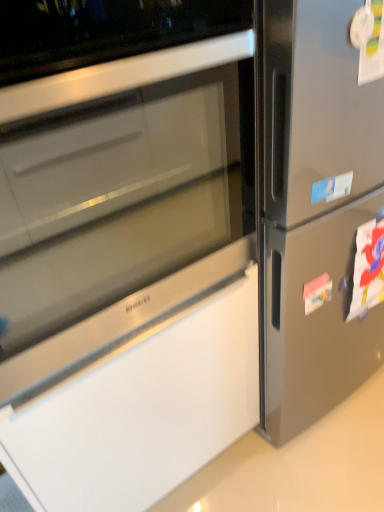
Question: From the image's perspective, is pink matte paper at right, positioned as the first sticker in bottom-to-top order, located above or below blue paper sticker at upper right, positioned as the 2th sticker in bottom-to-top order?

Choices:
 (A) below
 (B) above

Answer: (A)

Question: Does point (324, 288) appear closer or farther from the camera than point (345, 178)?

Choices:
 (A) closer
 (B) farther

Answer: (B)

Question: Considering the positions of pink matte paper at right, positioned as the first sticker in bottom-to-top order, and blue paper sticker at upper right, positioned as the 2th sticker in bottom-to-top order, in the image, is pink matte paper at right, positioned as the first sticker in bottom-to-top order, taller or shorter than blue paper sticker at upper right, positioned as the 2th sticker in bottom-to-top order,?

Choices:
 (A) short
 (B) tall

Answer: (B)

Question: From a real-world perspective, is blue paper sticker at upper right, which appears as the first sticker when viewed from the top, physically located above or below pink matte paper at right, positioned as the second sticker in top-to-bottom order?

Choices:
 (A) above
 (B) below

Answer: (A)

Question: Is blue paper sticker at upper right, which is the 1th sticker from front to back, inside or outside of pink matte paper at right, positioned as the second sticker in top-to-bottom order?

Choices:
 (A) inside
 (B) outside

Answer: (B)

Question: In terms of height, does blue paper sticker at upper right, the 2th sticker viewed from the back, look taller or shorter compared to pink matte paper at right, positioned as the first sticker in bottom-to-top order?

Choices:
 (A) short
 (B) tall

Answer: (A)

Question: Relative to pink matte paper at right, positioned as the second sticker in top-to-bottom order, is blue paper sticker at upper right, which appears as the first sticker when viewed from the top, in front or behind?

Choices:
 (A) front
 (B) behind

Answer: (A)